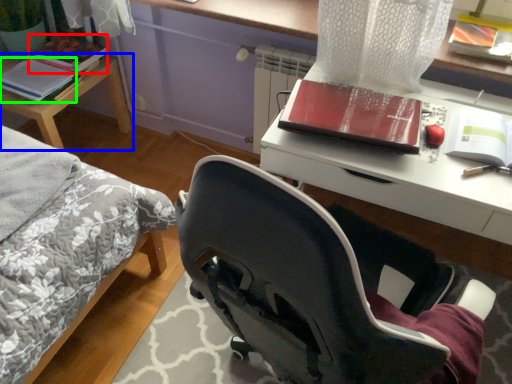
Question: Which object is the farthest from paperback book (highlighted by a red box)? Choose among these: table (highlighted by a blue box) or paperback book (highlighted by a green box).

Choices:
 (A) table
 (B) paperback book

Answer: (A)